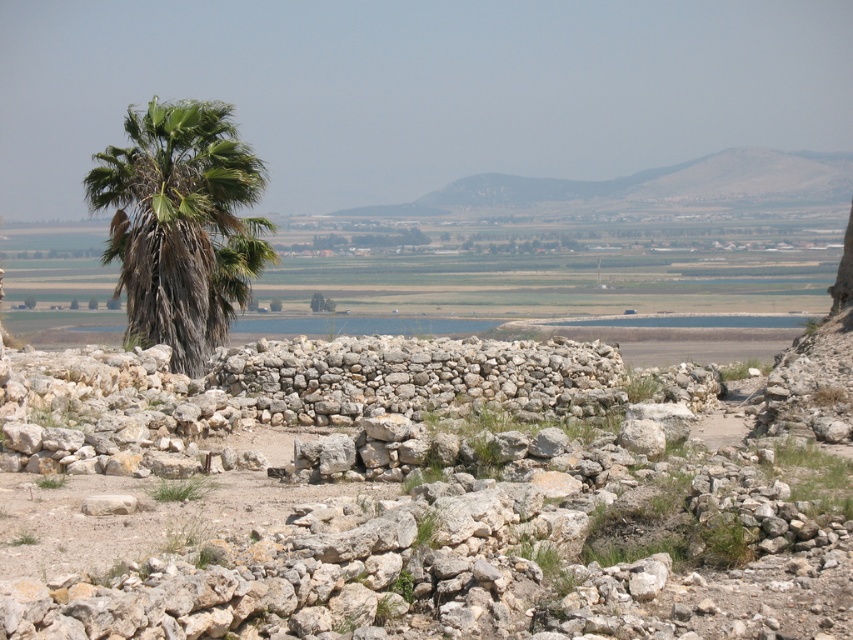
Question: Is gray stone wall at center to the right of green leafy tree at center from the viewer's perspective?

Choices:
 (A) yes
 (B) no

Answer: (A)

Question: Which point is farther to the camera?

Choices:
 (A) (38, 396)
 (B) (177, 266)

Answer: (B)

Question: Which is farther from the green leafy tree at center?

Choices:
 (A) green leafy palm at left
 (B) gray stone wall at center

Answer: (B)

Question: Can you confirm if gray stone wall at center is positioned to the right of green leafy tree at center?

Choices:
 (A) no
 (B) yes

Answer: (B)

Question: Does gray stone wall at center have a smaller size compared to green leafy palm at left?

Choices:
 (A) yes
 (B) no

Answer: (A)

Question: Which point is farther from the camera taking this photo?

Choices:
 (A) (80, 609)
 (B) (321, 298)

Answer: (B)